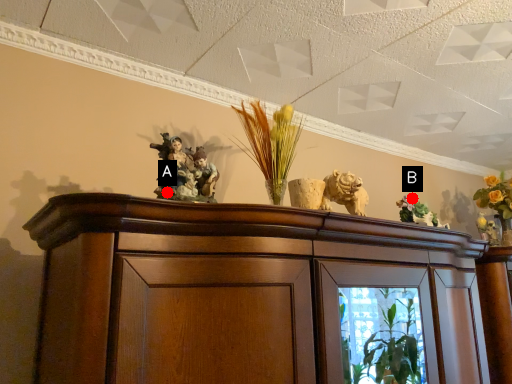
Question: Two points are circled on the image, labeled by A and B beside each circle. Which point is closer to the camera?

Choices:
 (A) A is closer
 (B) B is closer

Answer: (A)